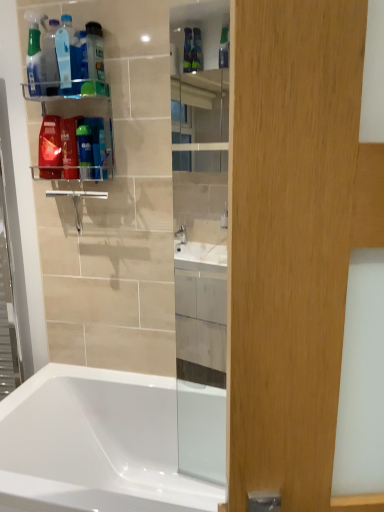
Question: Does white glossy bathtub at lower left have a smaller size compared to red glossy mouthwash at left?

Choices:
 (A) no
 (B) yes

Answer: (A)

Question: Is white glossy bathtub at lower left behind red glossy mouthwash at left?

Choices:
 (A) no
 (B) yes

Answer: (A)

Question: From a real-world perspective, is white glossy bathtub at lower left under red glossy mouthwash at left?

Choices:
 (A) yes
 (B) no

Answer: (A)

Question: Is white glossy bathtub at lower left far away from red glossy mouthwash at left?

Choices:
 (A) no
 (B) yes

Answer: (B)

Question: Is white glossy bathtub at lower left wider than red glossy mouthwash at left?

Choices:
 (A) no
 (B) yes

Answer: (B)

Question: Is the position of white glossy bathtub at lower left less distant than that of red glossy mouthwash at left?

Choices:
 (A) yes
 (B) no

Answer: (A)

Question: Considering the relative sizes of translucent plastic shaving cream at upper left and translucent plastic bottle at upper left, placed as the 3th cleaning product when sorted from left to right, in the image provided, is translucent plastic shaving cream at upper left thinner than translucent plastic bottle at upper left, placed as the 3th cleaning product when sorted from left to right,?

Choices:
 (A) no
 (B) yes

Answer: (B)

Question: Is translucent plastic bottle at upper left, placed as the 3th cleaning product when sorted from left to right, surrounded by translucent plastic shaving cream at upper left?

Choices:
 (A) no
 (B) yes

Answer: (A)

Question: Is translucent plastic shaving cream at upper left wider than translucent plastic bottle at upper left, which is the 1th cleaning product from right to left?

Choices:
 (A) no
 (B) yes

Answer: (A)

Question: From the image's perspective, would you say translucent plastic shaving cream at upper left is positioned over translucent plastic bottle at upper left, which is the 1th cleaning product from right to left?

Choices:
 (A) no
 (B) yes

Answer: (A)

Question: Does translucent plastic shaving cream at upper left turn towards translucent plastic bottle at upper left, which is the 1th cleaning product from right to left?

Choices:
 (A) yes
 (B) no

Answer: (B)

Question: Considering the relative sizes of translucent plastic shaving cream at upper left and translucent plastic bottle at upper left, which is the 1th cleaning product from right to left, in the image provided, is translucent plastic shaving cream at upper left smaller than translucent plastic bottle at upper left, which is the 1th cleaning product from right to left,?

Choices:
 (A) yes
 (B) no

Answer: (A)

Question: Does translucent plastic shaving cream at upper left turn towards white glossy bathtub at lower left?

Choices:
 (A) no
 (B) yes

Answer: (A)